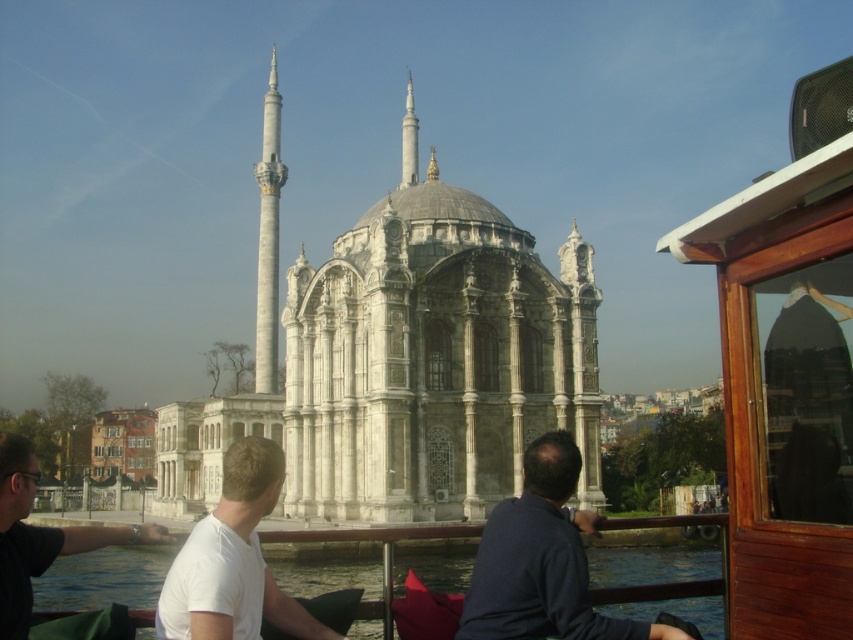
You are on a boat near the historic mosque and want to know which of the two points, point (579, 627) or point (163, 536), is closer to the mosque. Based on their positions, which point is in front of the other?

Point (579, 627) is in front of point (163, 536), so it is closer to the mosque.

You are standing on the dock and see the blue water at lower left and the white matte shirt at lower left. Which object is located to the right of the other?

The blue water at lower left is positioned on the right side of white matte shirt at lower left.